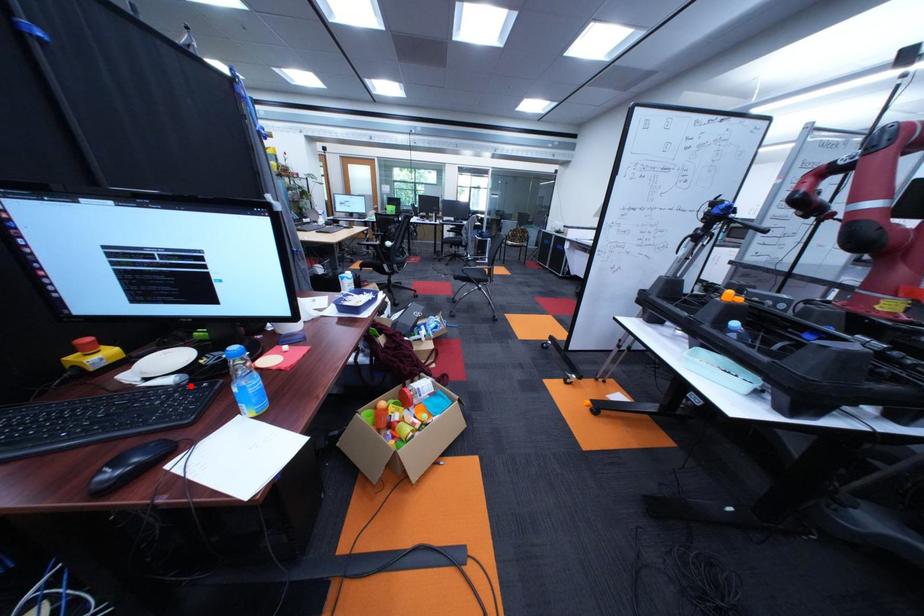
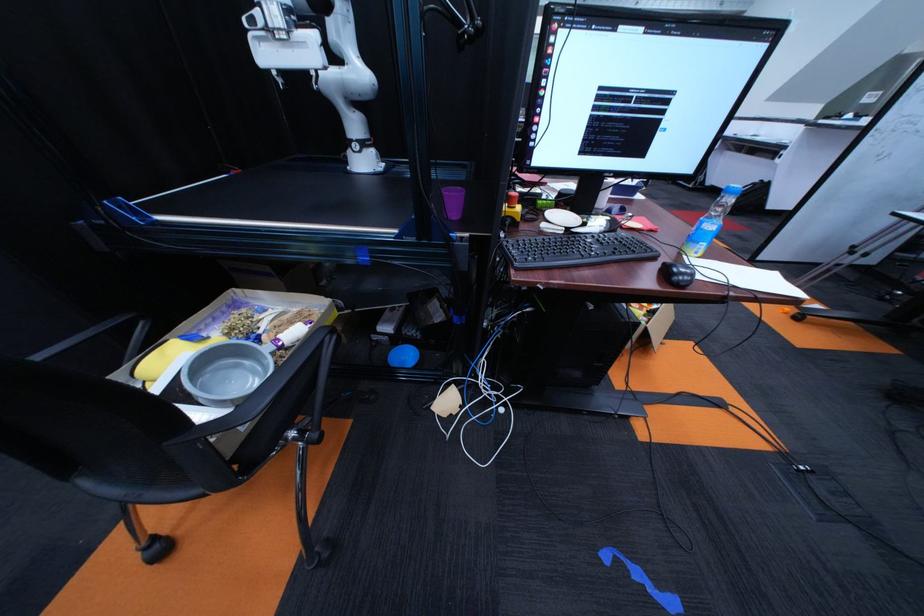
Where in the second image is the point corresponding to the highlighted location from the first image?

(614, 233)